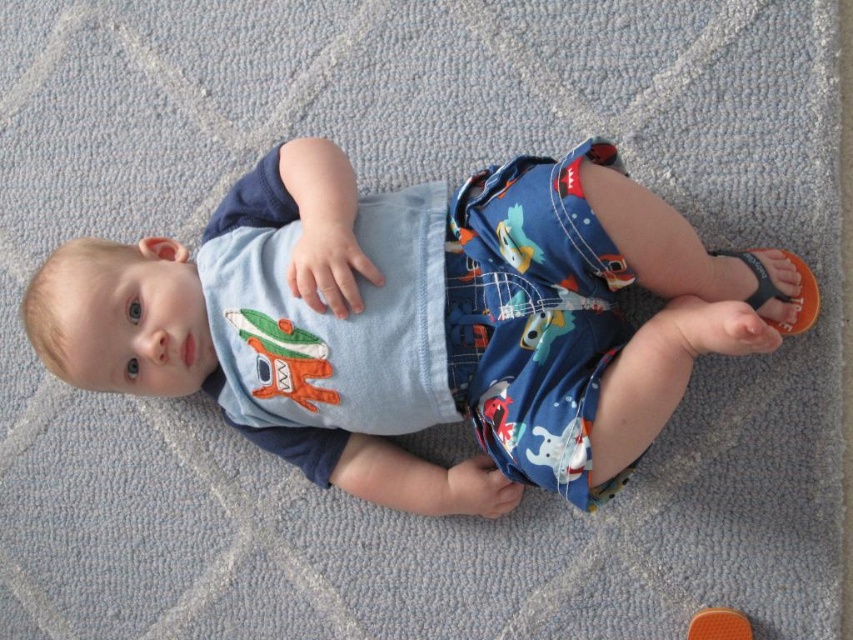
Does printed cotton diaper at center appear on the right side of orange flip-flop at lower right?

No, printed cotton diaper at center is not to the right of orange flip-flop at lower right.

Does printed cotton diaper at center have a greater height compared to orange flip-flop at lower right?

Yes, printed cotton diaper at center is taller than orange flip-flop at lower right.

Who is more forward, (515, 408) or (750, 300)?

Point (515, 408) is more forward.

You are a GUI agent. You are given a task and a screenshot of the screen. Output one action in this format:
    pyautogui.click(x=<x>, y=<y>)
    Task: Click on the printed cotton diaper at center
    This screenshot has width=853, height=640.
    Given the screenshot: What is the action you would take?
    pyautogui.click(x=532, y=316)

Is blue cotton baby at center thinner than orange flip-flop at lower right?

No, blue cotton baby at center is not thinner than orange flip-flop at lower right.

Which is behind, point (549, 317) or point (804, 328)?

The point (804, 328) is behind.

The width and height of the screenshot is (853, 640). Find the location of `blue cotton baby at center`. blue cotton baby at center is located at coordinates (413, 321).

Who is higher up, blue cotton baby at center or printed cotton diaper at center?

Positioned higher is printed cotton diaper at center.

Who is positioned more to the left, blue cotton baby at center or printed cotton diaper at center?

blue cotton baby at center is more to the left.

Measure the distance between blue cotton baby at center and camera.

blue cotton baby at center and camera are 36.89 inches apart.

Find the location of a particular element. The height and width of the screenshot is (640, 853). blue cotton baby at center is located at coordinates (413, 321).